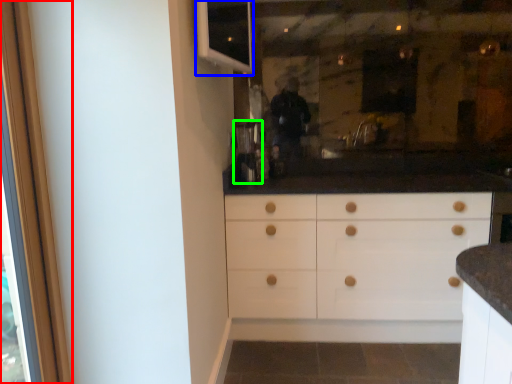
Question: Considering the real-world distances, which object is closest to screen door (highlighted by a red box)? window (highlighted by a blue box) or coffee machine (highlighted by a green box).

Choices:
 (A) window
 (B) coffee machine

Answer: (A)